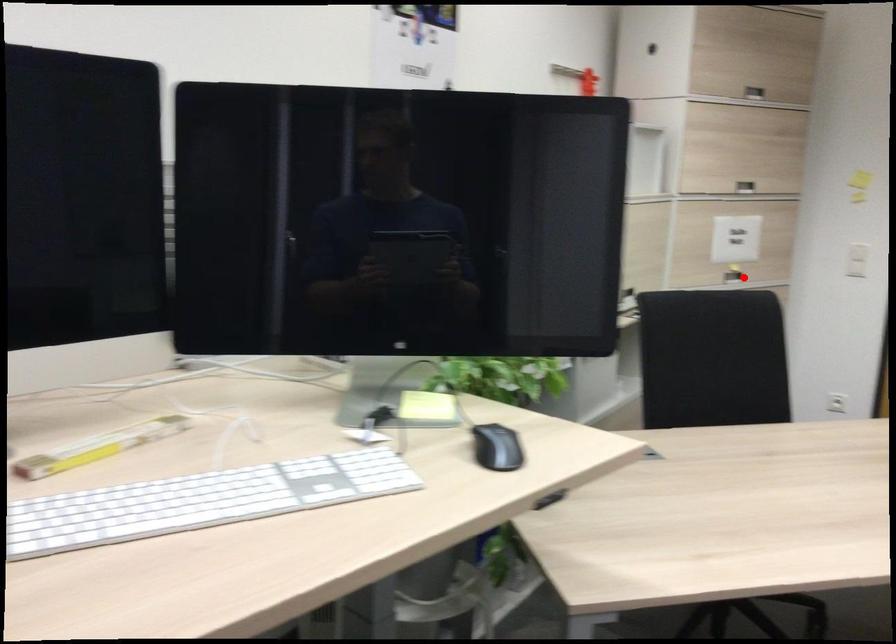
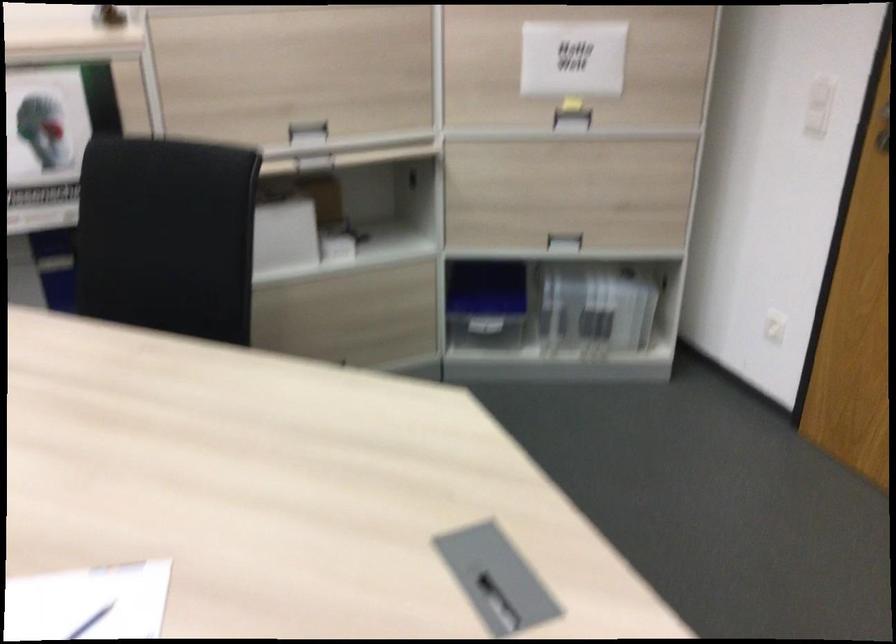
Question: I am providing you with two images of the same scene from different viewpoints. Image1 has a red point marked. In image2, the corresponding 3D location appears at what relative position? Reply with the corresponding letter.

Choices:
 (A) Closer
 (B) Farther

Answer: (A)